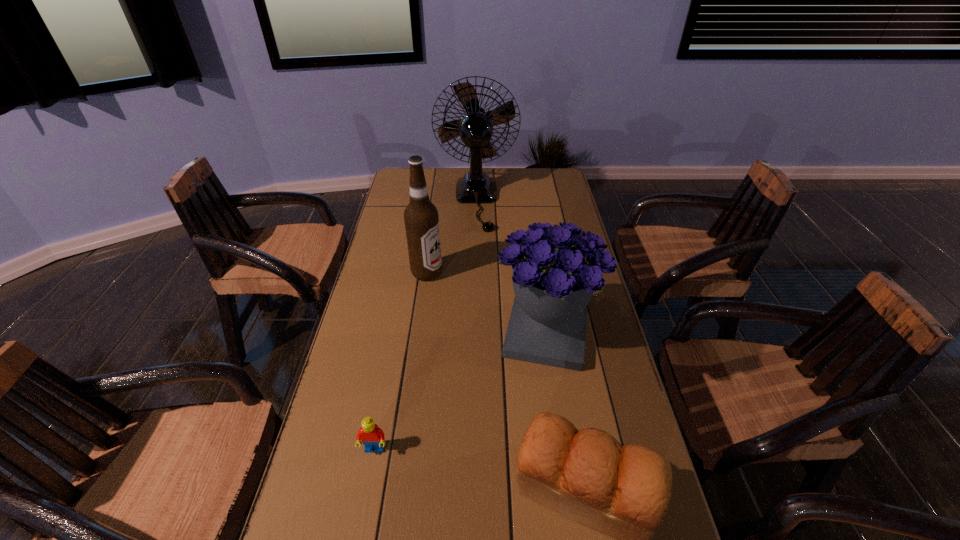
Identify the location of blank region between the third farthest object and the Lego. The width and height of the screenshot is (960, 540). (460, 393).

Locate an element on the screen. Image resolution: width=960 pixels, height=540 pixels. free spot between the fourth nearest object and the farthest object is located at coordinates point(451,237).

The image size is (960, 540). I want to click on vacant space that's between the farthest object and the third farthest object, so click(511, 268).

At what (x,y) coordinates should I click in order to perform the action: click on object identified as the third closest to the fan. Please return your answer as a coordinate pair (x, y). The height and width of the screenshot is (540, 960). Looking at the image, I should click on (623, 491).

Select which object appears as the closest to the bouquet. Please provide its 2D coordinates. Your answer should be formatted as a tuple, i.e. [(x, y)], where the tuple contains the x and y coordinates of a point satisfying the conditions above.

[(623, 491)]

Locate an element on the screen. vacant space that satisfies the following two spatial constraints: 1. on the label of the second farthest object; 2. on the left side of the third nearest object is located at coordinates (419, 335).

Locate an element on the screen. The height and width of the screenshot is (540, 960). free space that satisfies the following two spatial constraints: 1. in front of the farthest object, indicating the direction of air flow; 2. on the label of the fourth nearest object is located at coordinates (475, 273).

You are a GUI agent. You are given a task and a screenshot of the screen. Output one action in this format:
    pyautogui.click(x=<x>, y=<y>)
    Task: Click on the free space that satisfies the following two spatial constraints: 1. on the label of the alcohol; 2. on the back side of the third farthest object
    This screenshot has height=540, width=960.
    Given the screenshot: What is the action you would take?
    pyautogui.click(x=419, y=335)

The image size is (960, 540). What are the coordinates of `blank area in the image that satisfies the following two spatial constraints: 1. on the label of the fourth nearest object; 2. on the back side of the third tallest object` in the screenshot? It's located at (419, 335).

The image size is (960, 540). I want to click on blank space that satisfies the following two spatial constraints: 1. in front of the farthest object, indicating the direction of air flow; 2. on the label of the fourth nearest object, so click(x=475, y=273).